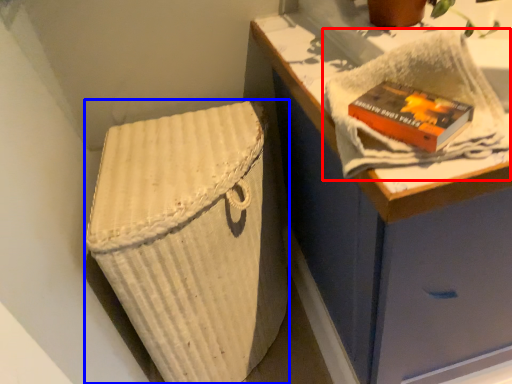
Question: Which point is closer to the camera, bath towel (highlighted by a red box) or laundry basket (highlighted by a blue box)?

Choices:
 (A) bath towel
 (B) laundry basket

Answer: (A)